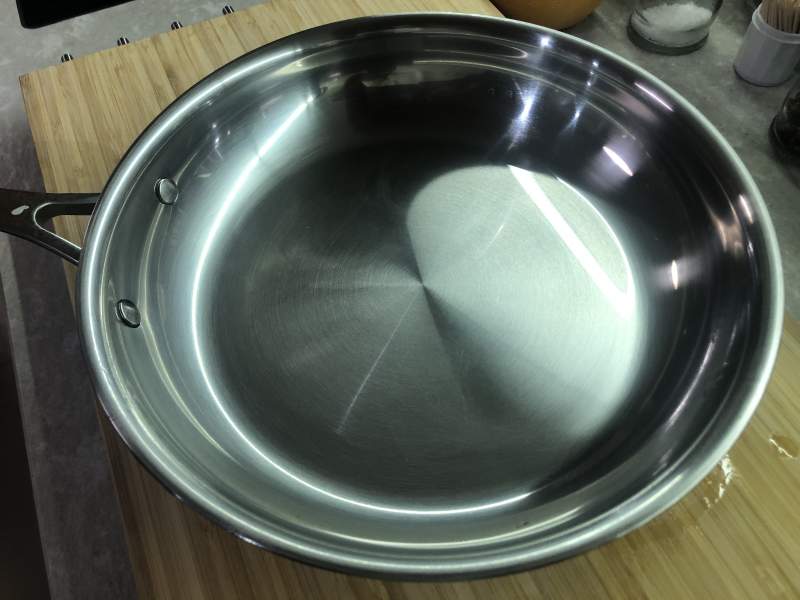
In order to click on glass in this screenshot , I will do [682, 33].